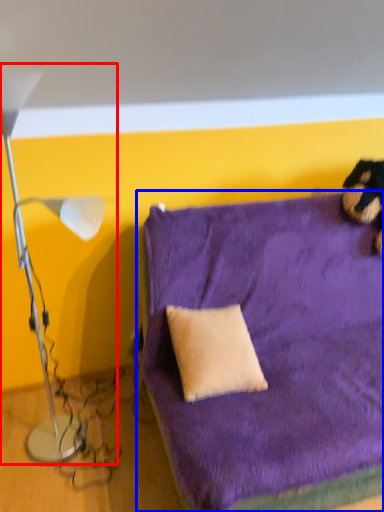
Question: Which object is closer to the camera taking this photo, lamp (highlighted by a red box) or furniture (highlighted by a blue box)?

Choices:
 (A) lamp
 (B) furniture

Answer: (A)